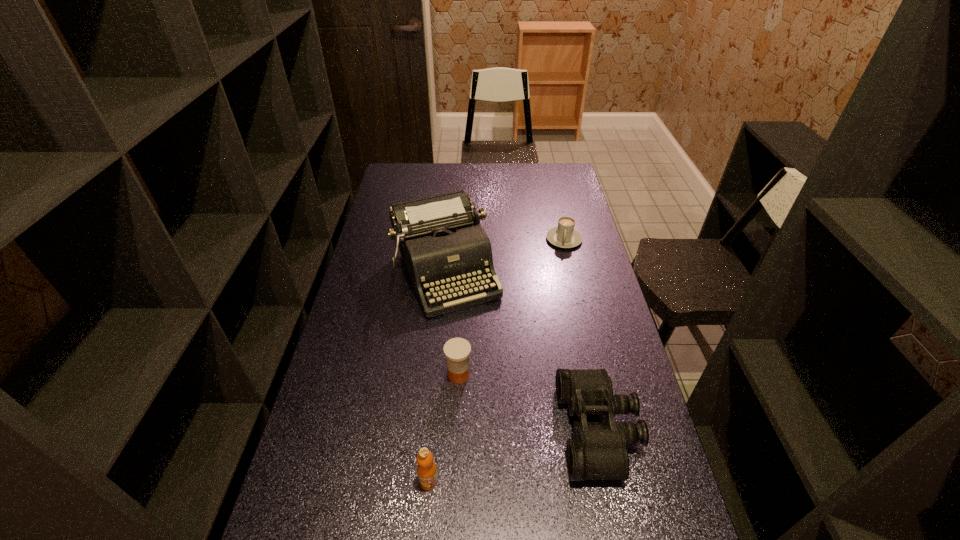
In order to click on unoccupied position between the binoculars and the typewriter in this screenshot , I will do `click(522, 351)`.

Where is `unoccupied position between the binoculars and the orange juice`? unoccupied position between the binoculars and the orange juice is located at coordinates (514, 455).

Identify the location of free space between the binoculars and the medicine. (528, 402).

Where is `vacant area that lies between the shortest object and the tallest object`? The image size is (960, 540). vacant area that lies between the shortest object and the tallest object is located at coordinates (505, 255).

Image resolution: width=960 pixels, height=540 pixels. I want to click on vacant area between the fourth shortest object and the cappuccino, so click(x=496, y=360).

Find the location of `free space between the orange juice and the binoculars`. free space between the orange juice and the binoculars is located at coordinates (514, 455).

Identify the location of object identified as the fourth closest to the binoculars. This screenshot has height=540, width=960. (565, 236).

Locate an element on the screen. This screenshot has width=960, height=540. object that ranks as the closest to the shortest object is located at coordinates (444, 247).

Image resolution: width=960 pixels, height=540 pixels. I want to click on vacant region that satisfies the following two spatial constraints: 1. on the front side of the typewriter; 2. at the eyepieces of the binoculars, so click(x=433, y=430).

Image resolution: width=960 pixels, height=540 pixels. In order to click on vacant space that satisfies the following two spatial constraints: 1. on the front side of the medicine; 2. at the eyepieces of the binoculars in this screenshot , I will do `click(456, 430)`.